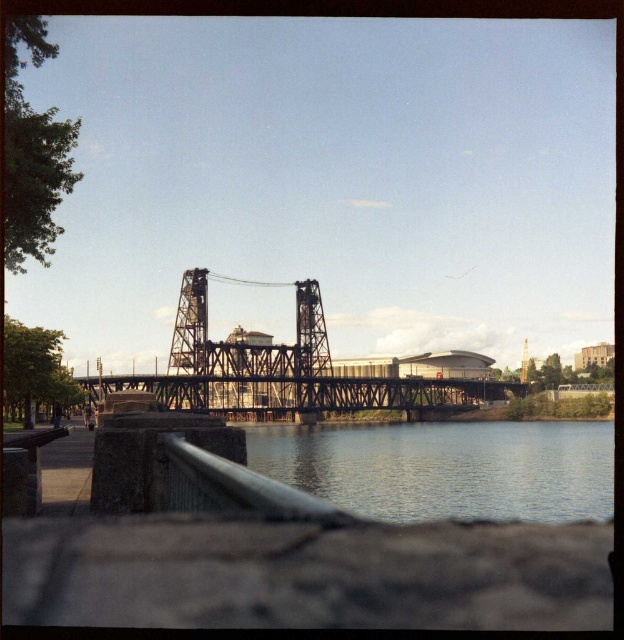
Question: Which of the following is the closest to the observer?

Choices:
 (A) clear water at lower center
 (B) black steel suspension bridge at center
 (C) metallic steel bridge at center

Answer: (B)

Question: Which of the following is the farthest from the observer?

Choices:
 (A) (469, 404)
 (B) (348, 387)

Answer: (A)

Question: Among these points, which one is nearest to the camera?

Choices:
 (A) (446, 396)
 (B) (240, 358)

Answer: (B)

Question: Is clear water at lower center bigger than black steel suspension bridge at center?

Choices:
 (A) yes
 (B) no

Answer: (B)

Question: Observing the image, what is the correct spatial positioning of clear water at lower center in reference to black steel suspension bridge at center?

Choices:
 (A) left
 (B) right

Answer: (B)

Question: Observing the image, what is the correct spatial positioning of black steel suspension bridge at center in reference to metallic steel bridge at center?

Choices:
 (A) right
 (B) left

Answer: (B)